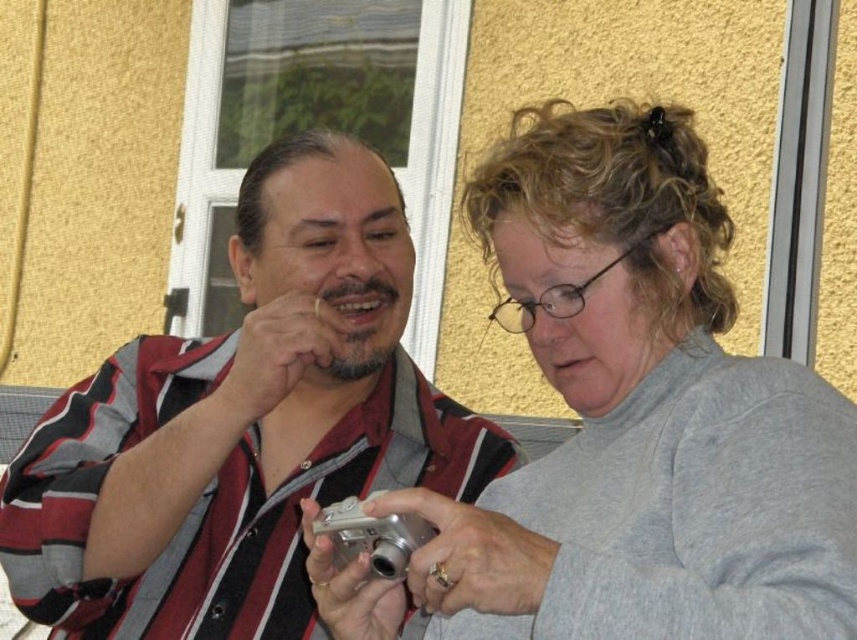
You are standing at the origin of the coordinate system in the image. You see two points marked in the scene. Which point is closer to you, point (663, 260) or point (235, 534)?

Point (663, 260) is in front of point (235, 534), so it is closer to you.

Where is the gray matte sweater at center located in the image?

The gray matte sweater at center is located at point 0.648 on the x axis and 0.747 on the y axis.

You are a fashion designer observing two people in the image. You need to determine which clothing item is shorter between the gray matte sweater at center and the striped fabric shirt at center. Which one is shorter?

The gray matte sweater at center is shorter than the striped fabric shirt at center according to the description.